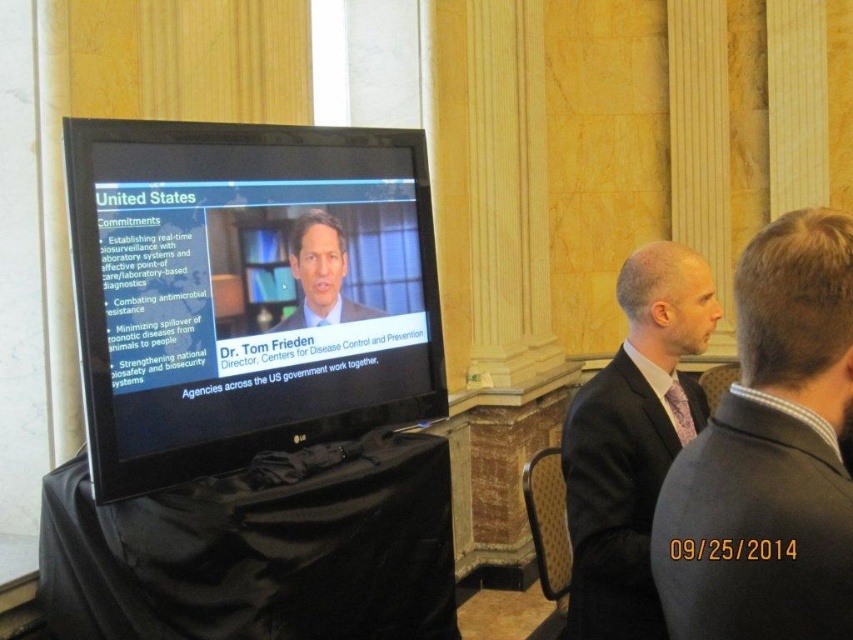
Question: Which object is the closest to the dark gray wool suit at center?

Choices:
 (A) dark gray suit at center
 (B) blue suit at center
 (C) black glossy monitor at center

Answer: (A)

Question: Is black glossy monitor at center wider than dark gray suit at center?

Choices:
 (A) yes
 (B) no

Answer: (A)

Question: Considering the real-world distances, which object is closest to the dark gray wool suit at center?

Choices:
 (A) dark gray suit at center
 (B) blue suit at center

Answer: (A)

Question: Which object appears closest to the camera in this image?

Choices:
 (A) dark gray wool suit at center
 (B) dark gray suit at center
 (C) black glossy monitor at center

Answer: (B)

Question: Can you confirm if black glossy monitor at center is smaller than blue suit at center?

Choices:
 (A) no
 (B) yes

Answer: (A)

Question: Is the position of dark gray wool suit at center less distant than that of blue suit at center?

Choices:
 (A) no
 (B) yes

Answer: (B)